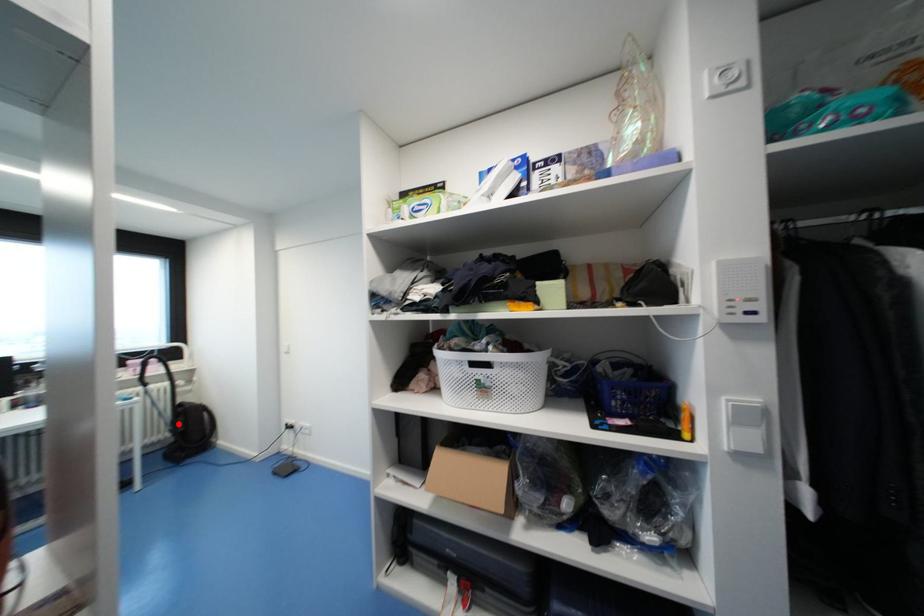
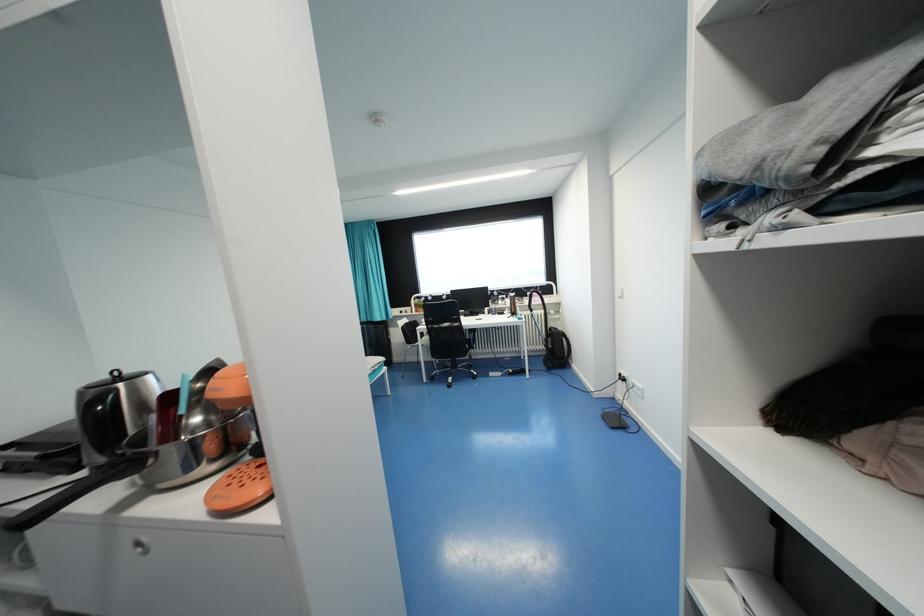
In the second image, find the point that corresponds to the highlighted location in the first image.

(551, 342)